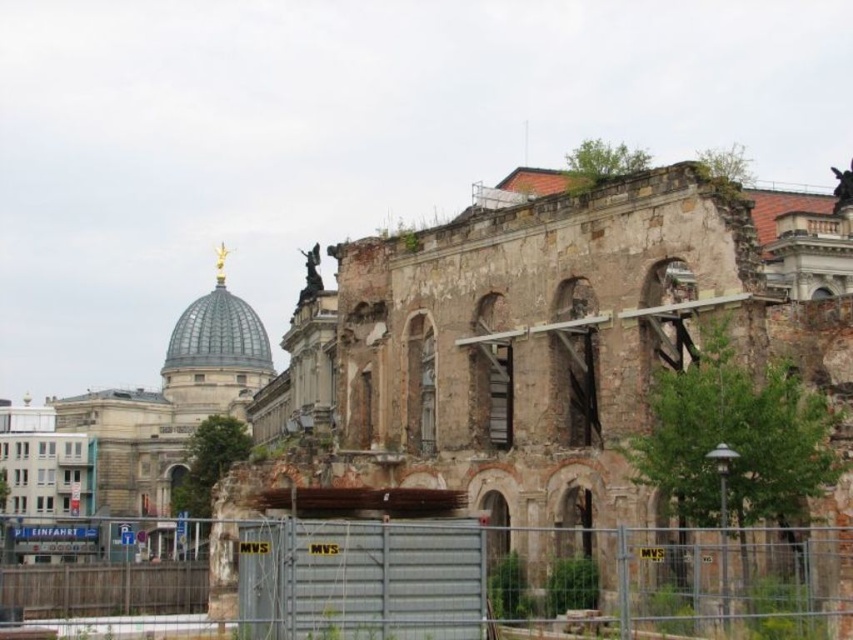
You are a construction worker assessing the site. You need to determine if the metallic gray fence at center can be moved closer to the weathered stone ruins at center without blocking the view of the dome behind. Based on their sizes, can the fence be positioned closer?

The weathered stone ruins at center is bigger than metallic gray fence at center. Since the fence is smaller, it can be moved closer without obstructing the view of the dome behind the ruins.

You are a construction worker tasked with assessing the stability of the weathered stone ruins at center and the metallic gray fence at center. Which object is located above the other?

The weathered stone ruins at center is positioned over the metallic gray fence at center, so the ruins are above the fence.

You are a construction worker who needs to transport materials from the weathered stone ruins at center to the metallic gray fence at center. Given that your wheelbarrow can carry a maximum load for distances up to 15 meters, will you be able to transport the materials without needing to unload halfway?

The distance between the weathered stone ruins at center and the metallic gray fence at center is 14.36 meters, which is within the wheelbarrow capacity of 15 meters. Therefore, you can transport the materials without needing to unload halfway.